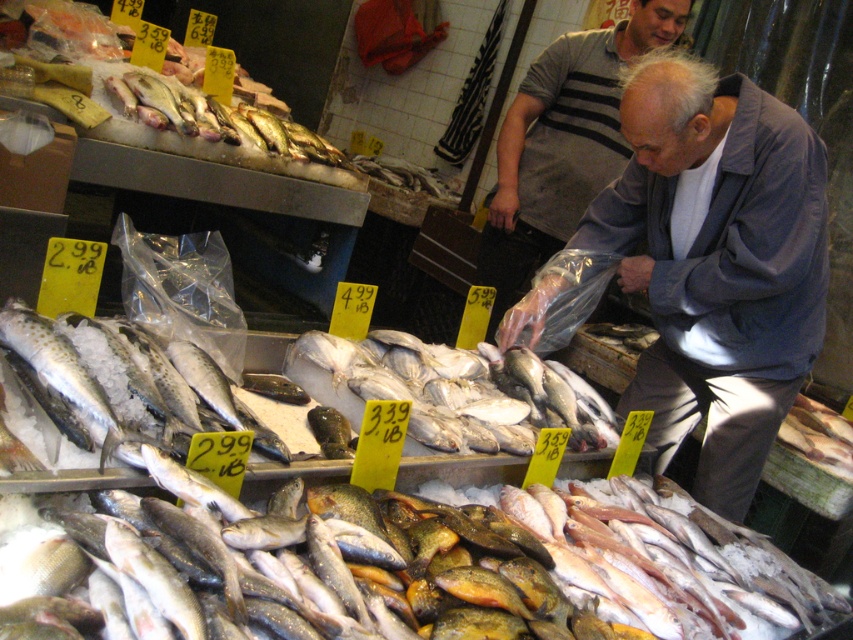
You are standing at the fish market and want to pick up an item located at point (236, 580). Can you reach it without moving your feet? The average person can reach up to 3 feet in front of them.

The distance between you and the point (236, 580) is 3.97 feet, which is beyond the average person reach of 3 feet. You will need to take a step forward to reach it.

Based on the photo, you are a customer at the fish market and want to pick up the shiny silver fish at lower center. Can you reach it without moving the gray fabric jacket at center?

The shiny silver fish at lower center is in front of the gray fabric jacket at center, so you can reach it without moving the jacket.